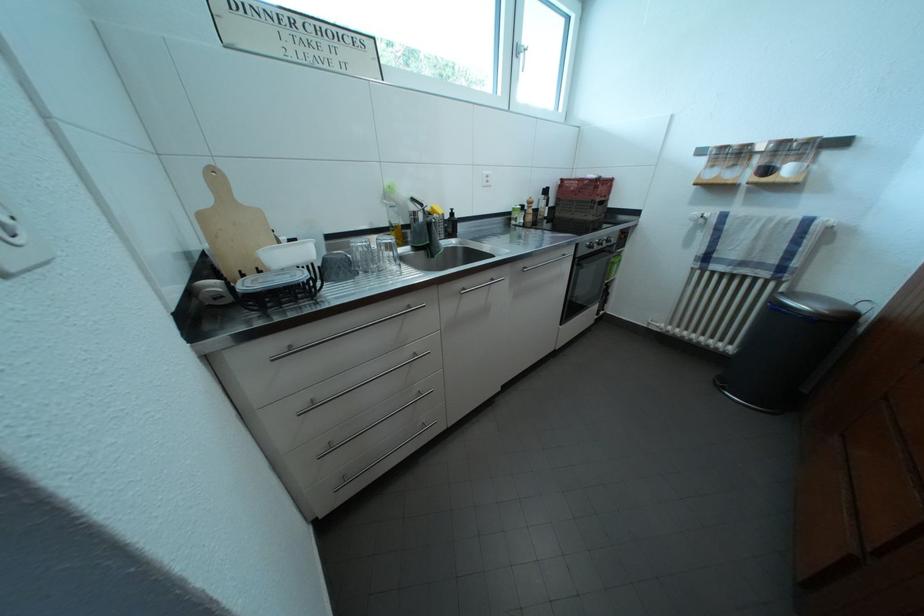
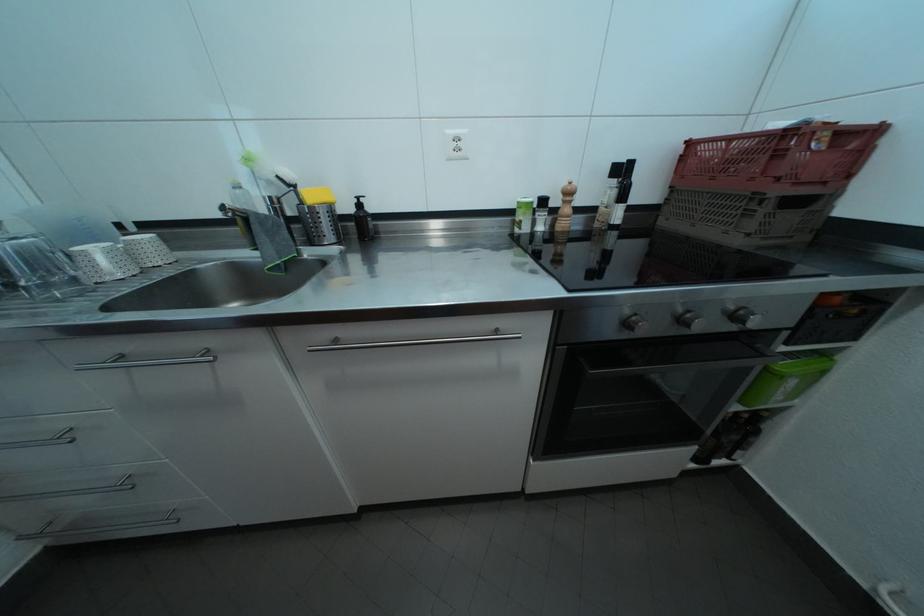
The point at (628, 261) is marked in the first image. Where is the corresponding point in the second image?

(833, 360)